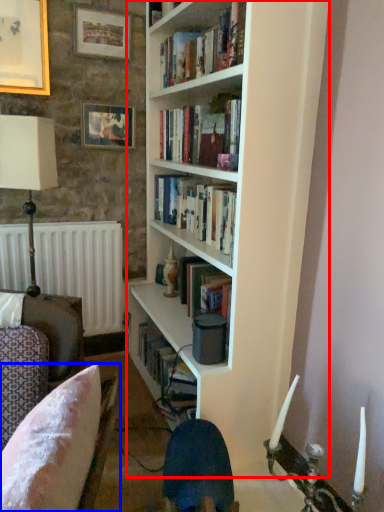
Question: Which point is further to the camera, bookcase (highlighted by a red box) or chair (highlighted by a blue box)?

Choices:
 (A) bookcase
 (B) chair

Answer: (A)